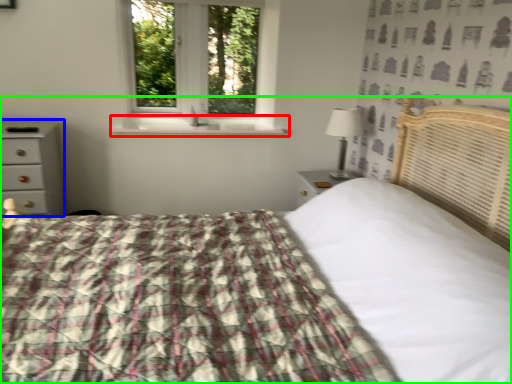
Question: Which object is the closest to the window sill (highlighted by a red box)? Choose among these: chest of drawers (highlighted by a blue box) or bed (highlighted by a green box).

Choices:
 (A) chest of drawers
 (B) bed

Answer: (A)